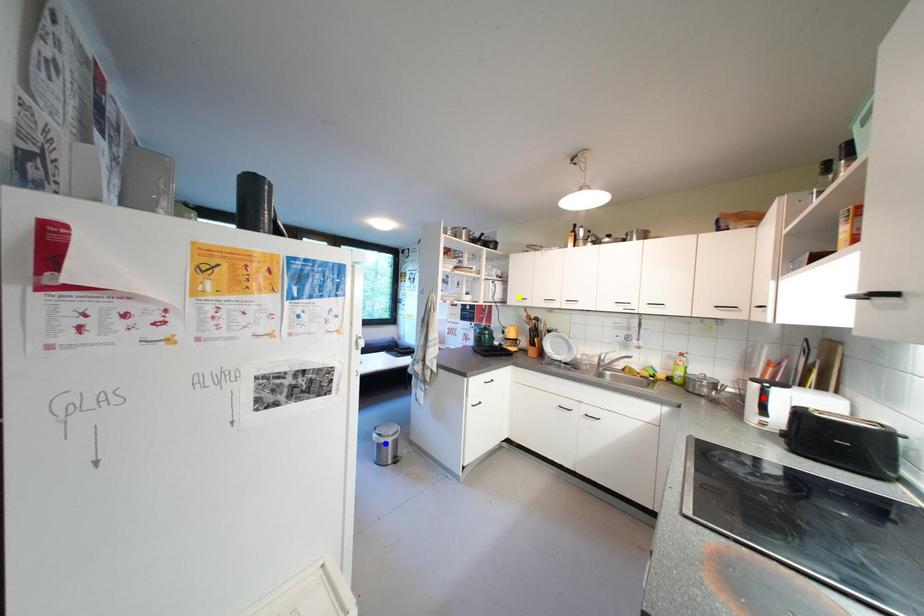
Order these from nearest to farthest:
- yellow point
- blue point
- red point

1. red point
2. blue point
3. yellow point